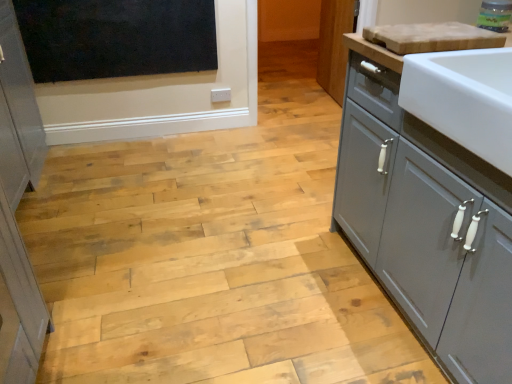
Question: Should I look upward or downward to see translucent glass jar at upper right?

Choices:
 (A) up
 (B) down

Answer: (A)

Question: Does white glossy sink at right have a greater width compared to light brown wood cutting board at upper right?

Choices:
 (A) yes
 (B) no

Answer: (A)

Question: Considering the relative sizes of white glossy sink at right and light brown wood cutting board at upper right in the image provided, is white glossy sink at right taller than light brown wood cutting board at upper right?

Choices:
 (A) no
 (B) yes

Answer: (B)

Question: Would you say white glossy sink at right is a long distance from light brown wood cutting board at upper right?

Choices:
 (A) no
 (B) yes

Answer: (A)

Question: Does white glossy sink at right appear on the right side of light brown wood cutting board at upper right?

Choices:
 (A) no
 (B) yes

Answer: (B)

Question: Does white glossy sink at right turn towards light brown wood cutting board at upper right?

Choices:
 (A) yes
 (B) no

Answer: (B)

Question: From a real-world perspective, is white glossy sink at right positioned over light brown wood cutting board at upper right based on gravity?

Choices:
 (A) no
 (B) yes

Answer: (A)

Question: Does translucent glass jar at upper right come behind light brown wood cutting board at upper right?

Choices:
 (A) no
 (B) yes

Answer: (B)

Question: From the image's perspective, is translucent glass jar at upper right located above light brown wood cutting board at upper right?

Choices:
 (A) yes
 (B) no

Answer: (A)

Question: Can you confirm if translucent glass jar at upper right is bigger than light brown wood cutting board at upper right?

Choices:
 (A) yes
 (B) no

Answer: (B)

Question: Is translucent glass jar at upper right next to light brown wood cutting board at upper right?

Choices:
 (A) yes
 (B) no

Answer: (B)

Question: From a real-world perspective, is translucent glass jar at upper right below light brown wood cutting board at upper right?

Choices:
 (A) yes
 (B) no

Answer: (B)

Question: Does translucent glass jar at upper right have a greater height compared to light brown wood cutting board at upper right?

Choices:
 (A) yes
 (B) no

Answer: (A)

Question: From a real-world perspective, is black matte window screen at upper left below light brown wood cutting board at upper right?

Choices:
 (A) yes
 (B) no

Answer: (A)